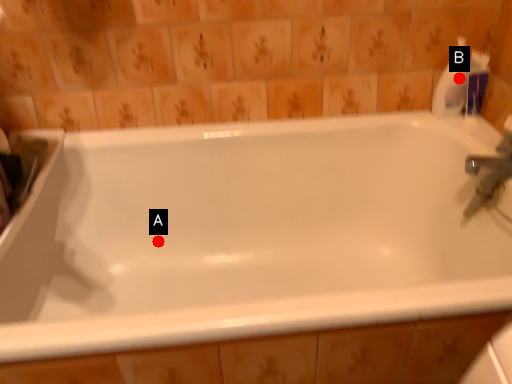
Question: Two points are circled on the image, labeled by A and B beside each circle. Which point is closer to the camera taking this photo?

Choices:
 (A) A is closer
 (B) B is closer

Answer: (B)